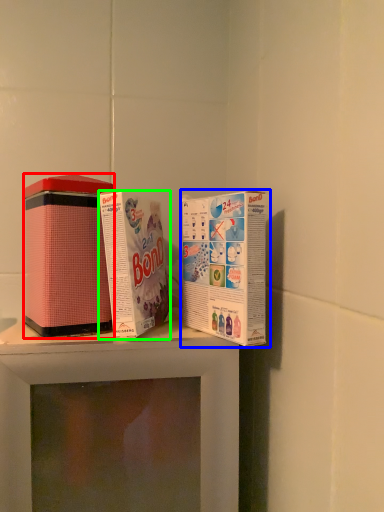
Question: Which object is positioned closest to product (highlighted by a red box)? Select from product (highlighted by a blue box) and product (highlighted by a green box).

Choices:
 (A) product
 (B) product

Answer: (B)